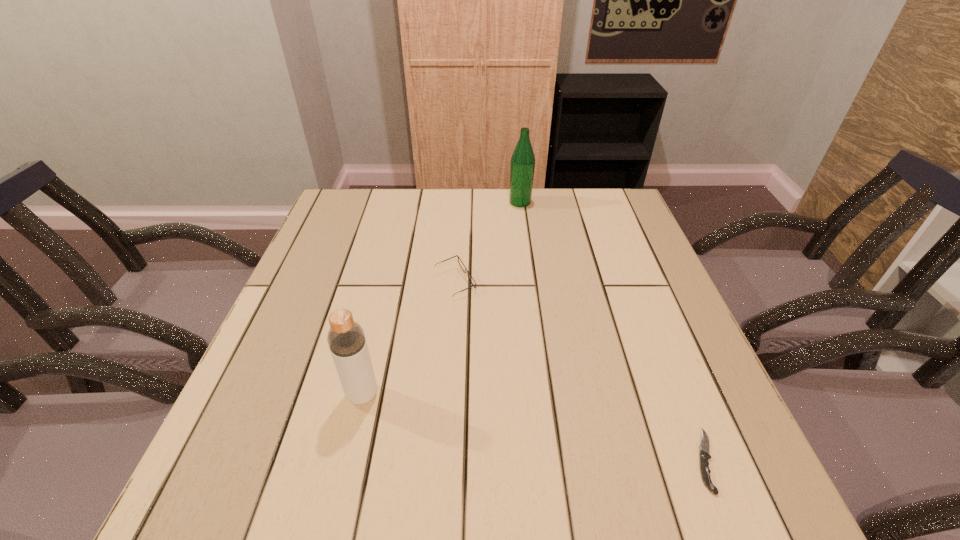
Locate an element on the screen. vacant space located with the lenses facing outward on the second shortest object is located at coordinates (616, 282).

Locate an element on the screen. vacant area situated 0.300m on the back of the nearest object is located at coordinates (646, 311).

The image size is (960, 540). I want to click on object at the far edge, so click(522, 165).

You are a GUI agent. You are given a task and a screenshot of the screen. Output one action in this format:
    pyautogui.click(x=<x>, y=<y>)
    Task: Click on the object at the near edge
    This screenshot has height=540, width=960.
    Given the screenshot: What is the action you would take?
    pyautogui.click(x=704, y=447)

I want to click on object located at the right edge, so click(704, 447).

Identify the location of object situated at the near right corner. This screenshot has height=540, width=960. [x=704, y=447].

At what (x,y) coordinates should I click in order to perform the action: click on vacant space at the far edge. Please return your answer as a coordinate pair (x, y). Looking at the image, I should click on (420, 218).

The width and height of the screenshot is (960, 540). Find the location of `vacant space at the left edge`. vacant space at the left edge is located at coordinates (327, 334).

Identify the location of vacant space at the right edge. (654, 296).

Find the location of a particular element. Image resolution: width=960 pixels, height=540 pixels. vacant space at the near left corner of the desktop is located at coordinates (254, 468).